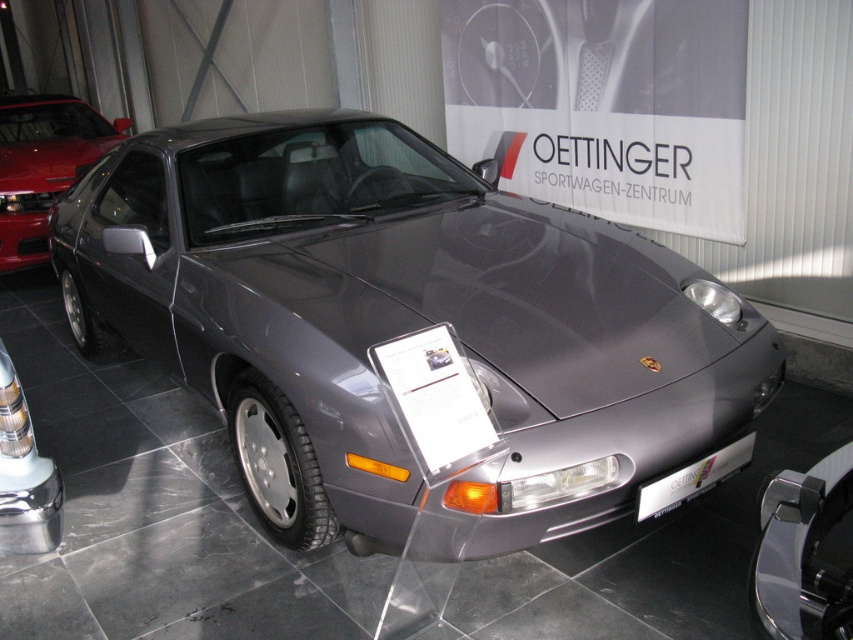
You are standing in front of the Porsche sports car at the showroom. You notice two points marked on the floor. The first point is at coordinate point (x=227, y=296) and the second is at point (x=643, y=500). If you were to walk from the first point to the second point, would you be moving towards the car or away from it?

Point (x=227, y=296) is behind point (x=643, y=500). Therefore, moving from the first point to the second point means you are moving away from the Porsche sports car.

You are a photographer setting up a shoot for the satin metallic car at center and the satin silver metallic car at center. You need to position them so that the taller car is behind the shorter one to avoid blocking the view. Which car should be placed in the back?

The satin metallic car at center is taller than the satin silver metallic car at center, so the satin metallic car at center should be placed in the back to avoid blocking the view.